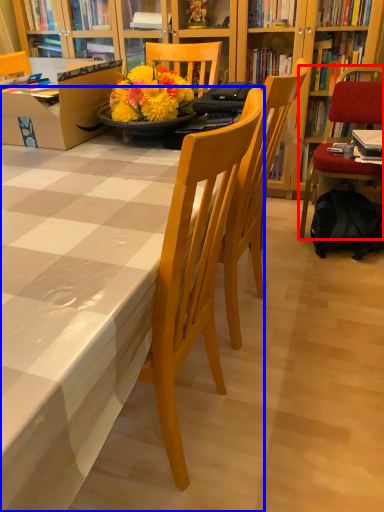
Question: Which point is further to the camera, chair (highlighted by a red box) or kitchen & dining room table (highlighted by a blue box)?

Choices:
 (A) chair
 (B) kitchen & dining room table

Answer: (A)